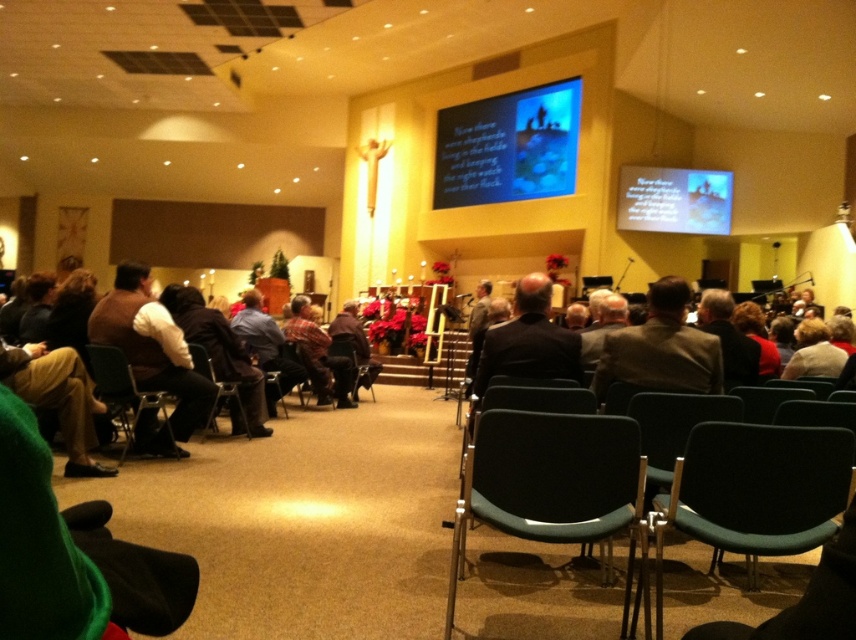
Question: Is black plastic chair at lower right positioned behind blue glossy projection screen at upper center?

Choices:
 (A) no
 (B) yes

Answer: (A)

Question: Which point appears farthest from the camera in this image?

Choices:
 (A) (324, 371)
 (B) (494, 502)
 (C) (233, 426)
 (D) (107, 346)

Answer: (A)

Question: In this image, where is dark brown leather jacket at center located relative to green plastic chair at lower right?

Choices:
 (A) above
 (B) below

Answer: (B)

Question: Does green plastic chair at lower left have a lesser width compared to blonde hair at lower right?

Choices:
 (A) no
 (B) yes

Answer: (B)

Question: Which object is closer to the camera taking this photo?

Choices:
 (A) dark brown leather jacket at center
 (B) brown sweater at left
 (C) matte blue screen at upper right
 (D) black plastic chair at lower right

Answer: (D)

Question: Which of the following is the farthest from the observer?

Choices:
 (A) plaid shirt at center
 (B) brown sweater at left

Answer: (A)